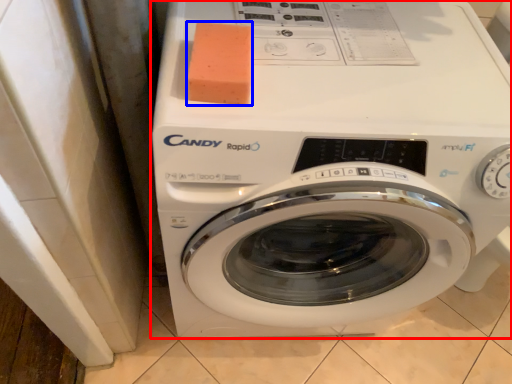
Question: Which object is closer to the camera taking this photo, washing machine (highlighted by a red box) or soap (highlighted by a blue box)?

Choices:
 (A) washing machine
 (B) soap

Answer: (A)